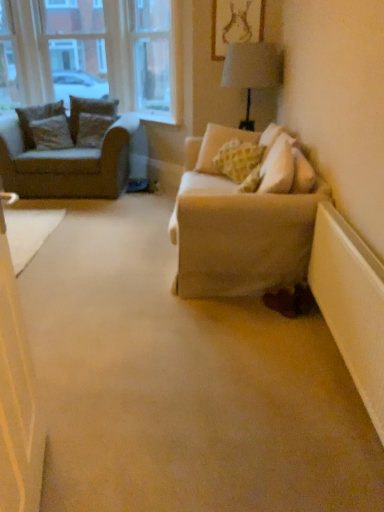
Question: Is clear glass window frame at upper left to the left or to the right of beige fabric armchair at left in the image?

Choices:
 (A) left
 (B) right

Answer: (B)

Question: Considering the positions of clear glass window frame at upper left and beige fabric armchair at left in the image, is clear glass window frame at upper left wider or thinner than beige fabric armchair at left?

Choices:
 (A) wide
 (B) thin

Answer: (B)

Question: Considering the real-world distances, which object is farthest from the velvet brown pillow at left, which ranks as the second pillow in right-to-left order?

Choices:
 (A) beige fabric armchair at left
 (B) brown textured pillow at left, arranged as the second pillow when viewed from the left
 (C) white plastic radiator at lower right
 (D) matte gold picture frame at upper center
 (E) clear glass window frame at upper left

Answer: (C)

Question: Which object is the closest to the beige fabric armchair at left?

Choices:
 (A) clear glass window frame at upper left
 (B) light beige fabric pillow at center, the fourth pillow when ordered from left to right
 (C) velvet brown pillow at left, which ranks as the second pillow in right-to-left order
 (D) matte gold picture frame at upper center
 (E) brown textured pillow at left, the third pillow from the right

Answer: (E)